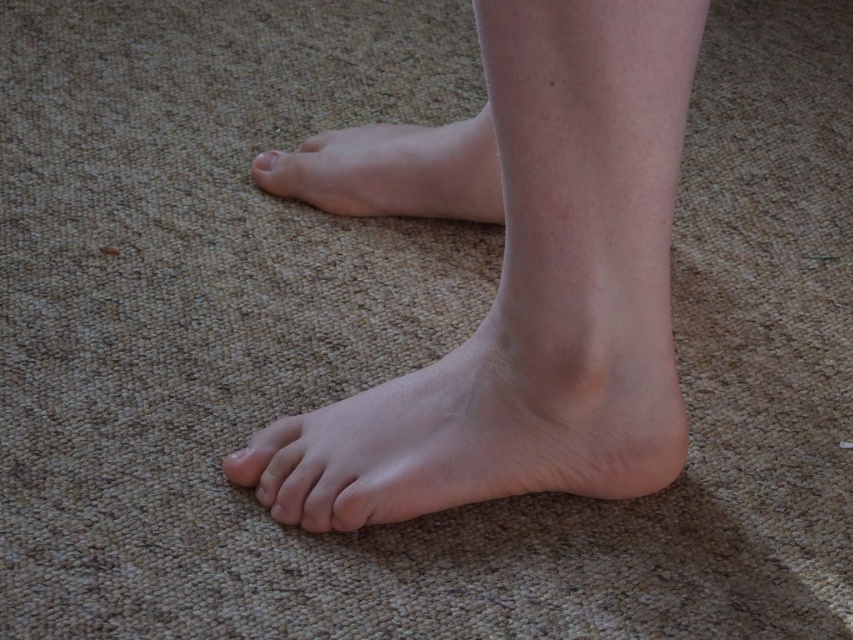
Can you confirm if skin-toned flesh at center is smaller than pale skin toe at center?

Incorrect, skin-toned flesh at center is not smaller in size than pale skin toe at center.

Does skin-toned flesh at center have a greater height compared to pale skin toe at center?

Indeed, skin-toned flesh at center has a greater height compared to pale skin toe at center.

Locate an element on the screen. This screenshot has width=853, height=640. skin-toned flesh at center is located at coordinates (514, 276).

This screenshot has height=640, width=853. I want to click on skin-toned flesh at center, so click(514, 276).

Is smooth skin foot at lower center below smooth skin foot at center?

Correct, smooth skin foot at lower center is located below smooth skin foot at center.

Which is more to the left, smooth skin foot at lower center or smooth skin foot at center?

From the viewer's perspective, smooth skin foot at center appears more on the left side.

Which is in front, point (650, 344) or point (340, 195)?

Point (650, 344) is more forward.

The width and height of the screenshot is (853, 640). I want to click on smooth skin foot at lower center, so click(x=477, y=432).

Can you confirm if skin-toned flesh at center is positioned to the left of smooth skin foot at lower center?

No, skin-toned flesh at center is not to the left of smooth skin foot at lower center.

What do you see at coordinates (514, 276) in the screenshot? I see `skin-toned flesh at center` at bounding box center [514, 276].

This screenshot has height=640, width=853. I want to click on skin-toned flesh at center, so click(514, 276).

The height and width of the screenshot is (640, 853). I want to click on skin-toned flesh at center, so (x=514, y=276).